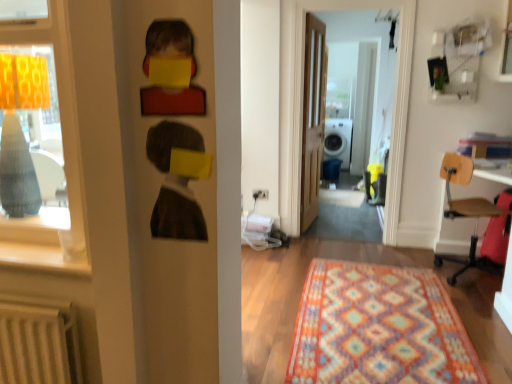
Describe the element at coordinates (169, 44) in the screenshot. Image resolution: width=512 pixels, height=384 pixels. I see `matte yellow paper at upper center` at that location.

At what (x,y) coordinates should I click in order to perform the action: click on multicolored woven rug at center. Please return your answer as a coordinate pair (x, y). This screenshot has height=384, width=512. Looking at the image, I should click on (378, 328).

What is the approximate width of matte gray lampshade at left?

The width of matte gray lampshade at left is 11.86 inches.

Image resolution: width=512 pixels, height=384 pixels. Find the location of `blue fabric armchair at center`. blue fabric armchair at center is located at coordinates (331, 169).

From a real-world perspective, relative to blue fabric armchair at center, is wooden seat chair at right vertically above or below?

Clearly, from a real-world perspective, wooden seat chair at right is above blue fabric armchair at center.

What's the angular difference between wooden seat chair at right and blue fabric armchair at center's facing directions?

The facing directions of wooden seat chair at right and blue fabric armchair at center are 17.2 degrees apart.

Between wooden seat chair at right and blue fabric armchair at center, which one appears on the right side from the viewer's perspective?

From the viewer's perspective, wooden seat chair at right appears more on the right side.

From the image's perspective, who appears lower, wooden seat chair at right or blue fabric armchair at center?

From the image's view, wooden seat chair at right is below.

From a real-world perspective, which is physically above, matte yellow paper at upper center or multicolored woven rug at center?

matte yellow paper at upper center is physically above.

From the image's perspective, between matte yellow paper at upper center and multicolored woven rug at center, which one is located above?

matte yellow paper at upper center is shown above in the image.

In the scene shown: Is matte yellow paper at upper center shorter than multicolored woven rug at center?

In fact, matte yellow paper at upper center may be taller than multicolored woven rug at center.

Does white plastic washer at center have a lesser height compared to blue fabric armchair at center?

No.

Is white plastic washer at center not close to blue fabric armchair at center?

No, white plastic washer at center is not far from blue fabric armchair at center.

Visually, is white plastic washer at center positioned to the left or to the right of blue fabric armchair at center?

Clearly, white plastic washer at center is on the right of blue fabric armchair at center in the image.

From the image's perspective, which object appears higher, white plastic washer at center or blue fabric armchair at center?

white plastic washer at center appears higher in the image.

Is matte wood window sill at left positioned with its back to matte yellow paper at upper center?

That's not correct — matte wood window sill at left is not looking away from matte yellow paper at upper center.

In the image, is matte wood window sill at left positioned in front of or behind matte yellow paper at upper center?

matte wood window sill at left is positioned farther from the viewer than matte yellow paper at upper center.

Which is closer, (x=17, y=257) or (x=170, y=41)?

The point (x=170, y=41) is in front.

Would you consider wooden seat chair at right to be distant from multicolored woven rug at center?

Yes, wooden seat chair at right and multicolored woven rug at center are quite far apart.

In the scene shown: Is wooden seat chair at right taller than multicolored woven rug at center?

Correct, wooden seat chair at right is much taller as multicolored woven rug at center.

Considering their positions, is wooden seat chair at right located in front of or behind multicolored woven rug at center?

wooden seat chair at right is behind multicolored woven rug at center.

How many degrees apart are the facing directions of transparent glass door at center and charcoal textured portrait at center?

transparent glass door at center and charcoal textured portrait at center are facing 0.00904 degrees away from each other.

Which object is wider, transparent glass door at center or charcoal textured portrait at center?

transparent glass door at center.

In order to click on person that appears in front of the transparent glass door at center in this screenshot , I will do (x=175, y=184).

Does transparent glass door at center turn towards charcoal textured portrait at center?

Yes, transparent glass door at center faces towards charcoal textured portrait at center.

From the image's perspective, which one is positioned higher, blue fabric armchair at center or white plastic washer at center?

white plastic washer at center, from the image's perspective.

Which of these two, blue fabric armchair at center or white plastic washer at center, stands shorter?

blue fabric armchair at center is shorter.

Is white plastic washer at center at the back of blue fabric armchair at center?

blue fabric armchair at center is not turned away from white plastic washer at center.

Is point (335, 172) positioned behind point (340, 140)?

No, it is not.

Find the location of a particular element. armchair on the left of wooden seat chair at right is located at coordinates click(331, 169).

The image size is (512, 384). In order to click on head above the multicolored woven rug at center (from a real-world perspective) in this screenshot , I will do `click(169, 44)`.

Estimate the real-world distances between objects in this image. Which object is closer to white plastic washer at center, charcoal textured portrait at center or multicolored woven rug at center?

multicolored woven rug at center is positioned closer to the anchor white plastic washer at center.

Considering their positions, is white plastic washer at center positioned further to matte wood window sill at left than charcoal textured portrait at center?

The object further to matte wood window sill at left is white plastic washer at center.

From the image, which object appears to be farther from matte gray lampshade at left, blue fabric armchair at center or white plastic washer at center?

white plastic washer at center.

Which object lies nearer to the anchor point matte yellow paper at upper center, wooden door at center or wooden seat chair at right?

The object closer to matte yellow paper at upper center is wooden seat chair at right.

Which object lies nearer to the anchor point blue fabric armchair at center, matte gray lampshade at left or matte yellow paper at upper center?

matte gray lampshade at left is positioned closer to the anchor blue fabric armchair at center.

Looking at this image, when comparing their distances from wooden seat chair at right, does charcoal textured portrait at center or blue fabric armchair at center seem further?

The object further to wooden seat chair at right is blue fabric armchair at center.

Based on their spatial positions, is multicolored woven rug at center or matte white window frame at left further from transparent glass door at center?

matte white window frame at left is positioned further to the anchor transparent glass door at center.

Looking at this image, looking at the image, which one is located further to transparent glass door at center, blue fabric armchair at center or multicolored woven rug at center?

blue fabric armchair at center is positioned further to the anchor transparent glass door at center.

Identify the location of lamp located between matte yellow paper at upper center and wooden door at center in the depth direction. This screenshot has height=384, width=512. (20, 130).

Where is `door positioned between matte white window frame at left and blue fabric armchair at center from near to far`? Image resolution: width=512 pixels, height=384 pixels. door positioned between matte white window frame at left and blue fabric armchair at center from near to far is located at coordinates (313, 118).

You are a GUI agent. You are given a task and a screenshot of the screen. Output one action in this format:
    pyautogui.click(x=<x>, y=<y>)
    Task: Click on the person between matte white window frame at left and blue fabric armchair at center from front to back
    This screenshot has height=384, width=512.
    Given the screenshot: What is the action you would take?
    pyautogui.click(x=175, y=184)

Image resolution: width=512 pixels, height=384 pixels. Identify the location of window screen between charcoal textured portrait at center and wooden door at center along the z-axis. (393, 108).